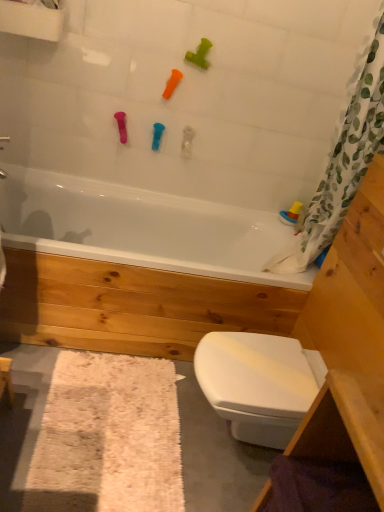
Question: Can you confirm if green rubber toy at upper center, which ranks as the first toy in top-to-bottom order, is positioned to the right of white glossy bathtub at center?

Choices:
 (A) yes
 (B) no

Answer: (A)

Question: From a real-world perspective, is green rubber toy at upper center, the third toy when ordered from left to right, physically above white glossy bathtub at center?

Choices:
 (A) no
 (B) yes

Answer: (B)

Question: Can you confirm if green rubber toy at upper center, placed as the 4th toy when sorted from back to front, is taller than white glossy bathtub at center?

Choices:
 (A) yes
 (B) no

Answer: (B)

Question: From the image's perspective, is green rubber toy at upper center, the first toy from the front, beneath white glossy bathtub at center?

Choices:
 (A) no
 (B) yes

Answer: (A)

Question: Is the surface of green rubber toy at upper center, placed as the 4th toy when sorted from back to front, in direct contact with white glossy bathtub at center?

Choices:
 (A) no
 (B) yes

Answer: (A)

Question: Considering the positions of white glossy bathtub at center and white glossy bidet at lower right in the image, is white glossy bathtub at center wider or thinner than white glossy bidet at lower right?

Choices:
 (A) wide
 (B) thin

Answer: (A)

Question: Do you think white glossy bathtub at center is within white glossy bidet at lower right, or outside of it?

Choices:
 (A) outside
 (B) inside

Answer: (A)

Question: From the image's perspective, is white glossy bathtub at center located above or below white glossy bidet at lower right?

Choices:
 (A) below
 (B) above

Answer: (B)

Question: In the image, is white glossy bathtub at center positioned in front of or behind white glossy bidet at lower right?

Choices:
 (A) behind
 (B) front

Answer: (A)

Question: Is translucent plastic boat at right, the 1th toy in the back-to-front sequence, inside or outside of white shaggy bath mat at lower left?

Choices:
 (A) inside
 (B) outside

Answer: (B)

Question: From the image's perspective, is translucent plastic boat at right, the first toy in the right-to-left sequence, positioned above or below white shaggy bath mat at lower left?

Choices:
 (A) below
 (B) above

Answer: (B)

Question: In terms of height, does translucent plastic boat at right, the first toy in the right-to-left sequence, look taller or shorter compared to white shaggy bath mat at lower left?

Choices:
 (A) short
 (B) tall

Answer: (A)

Question: Is translucent plastic boat at right, marked as the first toy in a bottom-to-top arrangement, bigger or smaller than white shaggy bath mat at lower left?

Choices:
 (A) big
 (B) small

Answer: (B)

Question: Is white glossy bidet at lower right to the left or to the right of translucent plastic boat at right, marked as the 4th toy in a left-to-right arrangement, in the image?

Choices:
 (A) left
 (B) right

Answer: (A)

Question: Is white glossy bidet at lower right taller or shorter than translucent plastic boat at right, the 1th toy in the back-to-front sequence?

Choices:
 (A) tall
 (B) short

Answer: (A)